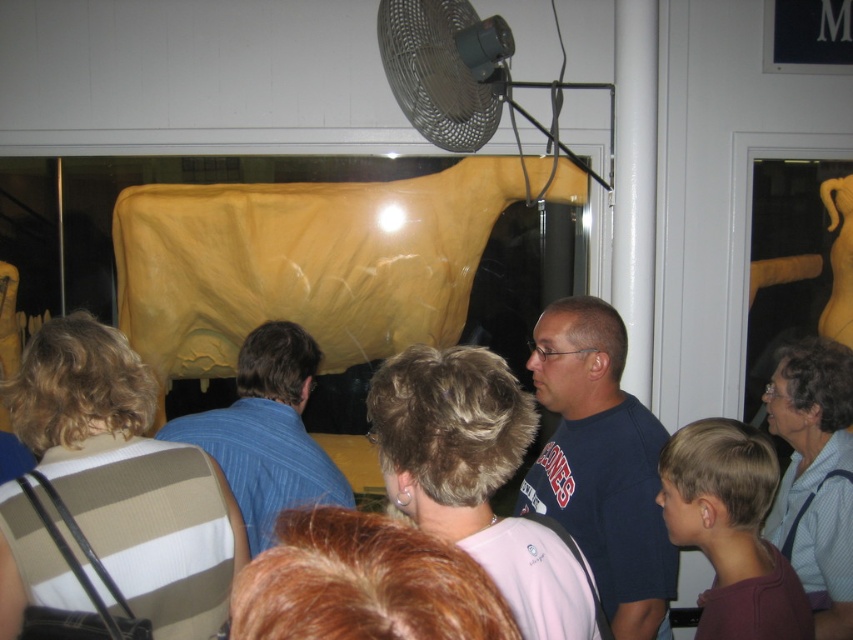
In the scene shown: You are at an art exhibition and notice the blue striped shirt at center and the black mesh fan at upper center. Which object is closer to you?

The blue striped shirt at center is closer to you because the black mesh fan at upper center is behind it.

You are standing in the room and want to get a better view of the sculpture behind the yellow tarp. The brown striped shirt at center and the black mesh fan at upper center are in your line of sight. Which object should you move to see past?

To get a better view of the sculpture behind the yellow tarp, you should move around the brown striped shirt at center because it is below the black mesh fan at upper center, meaning the shirt is closer to you and blocking your view.